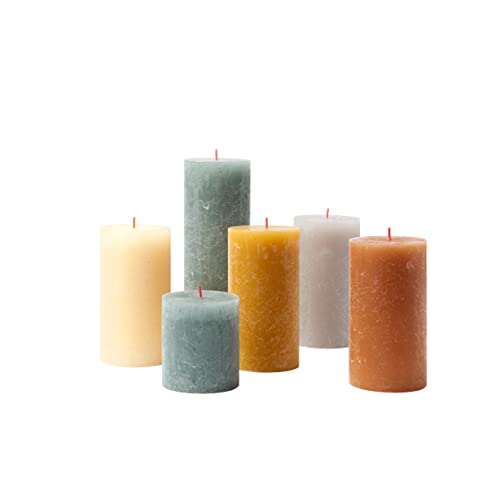
Where is `candles`? The width and height of the screenshot is (500, 500). candles is located at coordinates (207, 340), (196, 257), (133, 279), (266, 284), (325, 276), (386, 294).